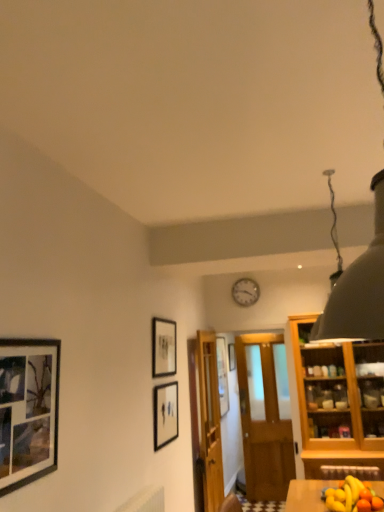
The width and height of the screenshot is (384, 512). In order to click on free spot above wooden door at center, the 1th door when ordered from right to left (from a real-world perspective) in this screenshot , I will do `click(253, 316)`.